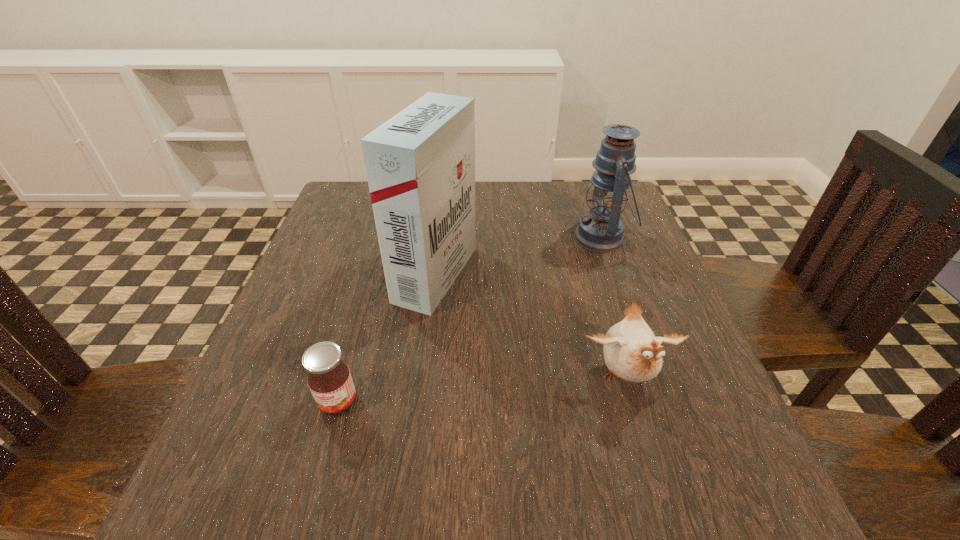
Identify the location of vacant space located at the beak of the second shortest object. Image resolution: width=960 pixels, height=540 pixels. (659, 491).

The height and width of the screenshot is (540, 960). Identify the location of free space located 0.050m on the label side of the leftmost object. (324, 450).

I want to click on object that is at the far edge, so click(x=601, y=231).

The width and height of the screenshot is (960, 540). Identify the location of object that is at the left edge. (329, 379).

The width and height of the screenshot is (960, 540). Identify the location of lantern situated at the right edge. (601, 231).

Locate an element on the screen. The image size is (960, 540). bird at the right edge is located at coordinates coord(631,351).

Where is `object that is at the far right corner`? The width and height of the screenshot is (960, 540). object that is at the far right corner is located at coordinates (601, 231).

In the image, there is a desktop. Where is `vacant space at the far edge`? The image size is (960, 540). vacant space at the far edge is located at coordinates (556, 187).

Where is `vacant space at the near edge of the desktop`? Image resolution: width=960 pixels, height=540 pixels. vacant space at the near edge of the desktop is located at coordinates (396, 517).

Image resolution: width=960 pixels, height=540 pixels. In order to click on vacant area at the left edge in this screenshot , I will do `click(261, 383)`.